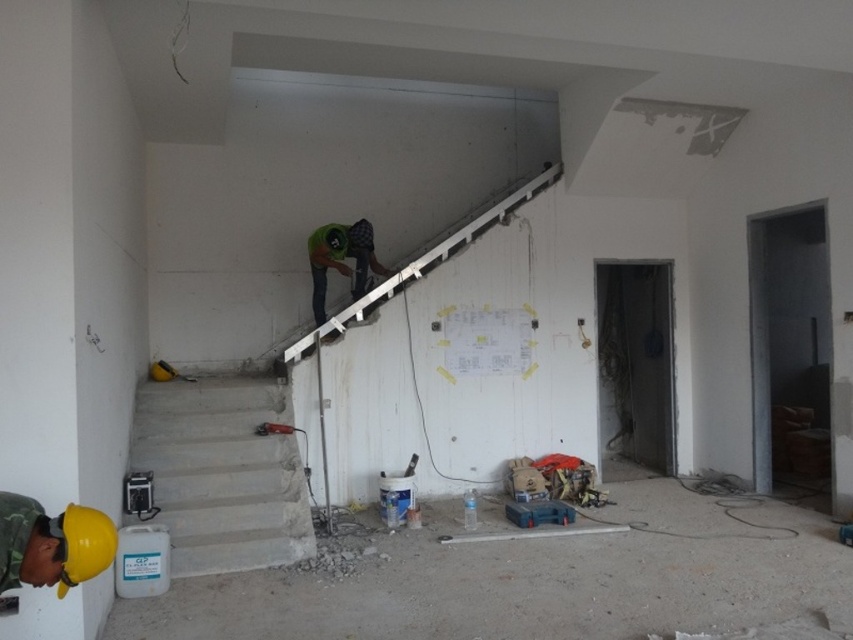
You are a construction inspector who needs to ensure safety standards are met. You notice the concrete stairs at lower left and the green fabric construction worker at center. Based on their widths, which one is wider?

The concrete stairs at lower left are wider than the green fabric construction worker at center because the description states that the concrete stairs at lower left surpass the green fabric construction worker at center in width.

You are a delivery person trying to reach the construction worker at the center of the image. The stairs are in the way. Can you walk around the concrete stairs at lower left to get to the green fabric construction worker at center?

The concrete stairs at lower left are to the left of the green fabric construction worker at center, so you can walk around the stairs on the right side to reach the green fabric construction worker at center.